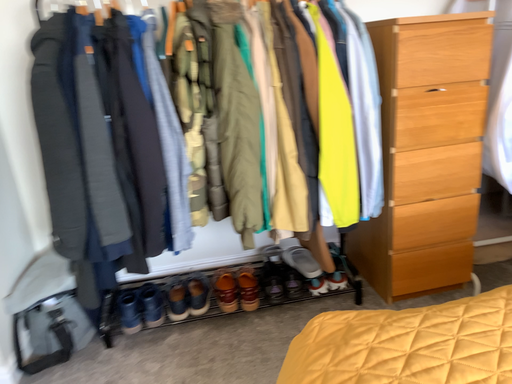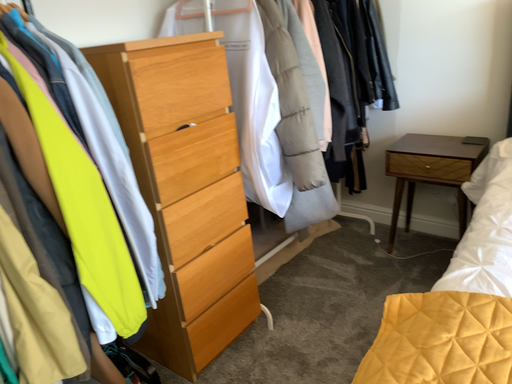
Question: Which way did the camera rotate in the video?

Choices:
 (A) rotated right
 (B) rotated left

Answer: (A)